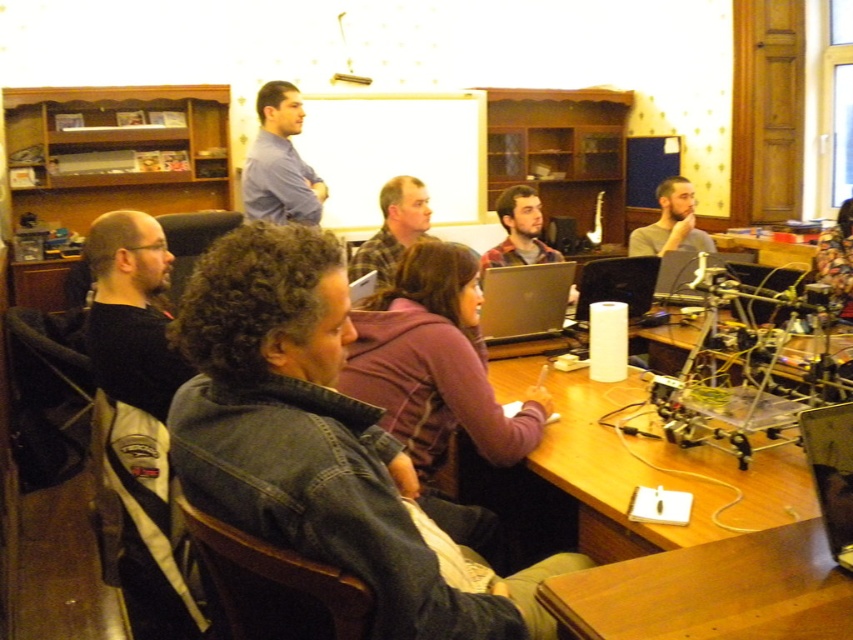
You are standing in the classroom and want to locate the black plastic laptop at center. What are the coordinates where you can find it?

The black plastic laptop at center can be found at coordinates point (618,284).

You are standing at the entrance of the room and want to approach the wooden desk at lower right. Based on the coordinates provided in the scene description, in which general direction should you move from your current position?

The wooden desk at lower right is located at point (712, 592), which is towards the bottom right corner of the frame. Therefore, you should move towards the lower right direction to reach it.